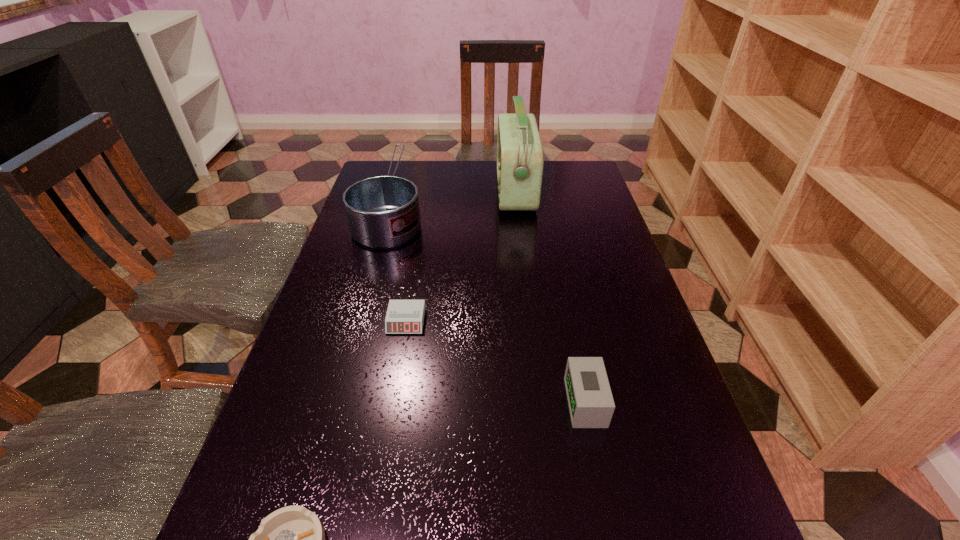
You are a GUI agent. You are given a task and a screenshot of the screen. Output one action in this format:
    pyautogui.click(x=<x>, y=<y>)
    Task: Click on the vacant point located 0.270m on the front-facing side of the second nearest object
    
    Given the screenshot: What is the action you would take?
    pyautogui.click(x=425, y=402)

Locate an element on the screen. The image size is (960, 540). free space located 0.370m on the front-facing side of the second nearest object is located at coordinates (372, 402).

The height and width of the screenshot is (540, 960). I want to click on vacant space located 0.130m on the front-facing side of the second nearest object, so click(499, 402).

Image resolution: width=960 pixels, height=540 pixels. I want to click on free spot located 0.310m on the right of the left alarm clock, so click(562, 321).

You are a GUI agent. You are given a task and a screenshot of the screen. Output one action in this format:
    pyautogui.click(x=<x>, y=<y>)
    Task: Click on the radio receiver that is at the far edge
    This screenshot has height=540, width=960.
    Given the screenshot: What is the action you would take?
    pyautogui.click(x=520, y=157)

Identify the location of saucepan present at the far edge. The height and width of the screenshot is (540, 960). (383, 211).

Locate an element on the screen. The height and width of the screenshot is (540, 960). object that is positioned at the left edge is located at coordinates (383, 211).

This screenshot has height=540, width=960. Find the location of `object at the right edge`. object at the right edge is located at coordinates (591, 405).

I want to click on object that is positioned at the far left corner, so click(x=383, y=211).

Image resolution: width=960 pixels, height=540 pixels. In the image, there is a desktop. In order to click on vacant space at the left edge in this screenshot , I will do point(324,498).